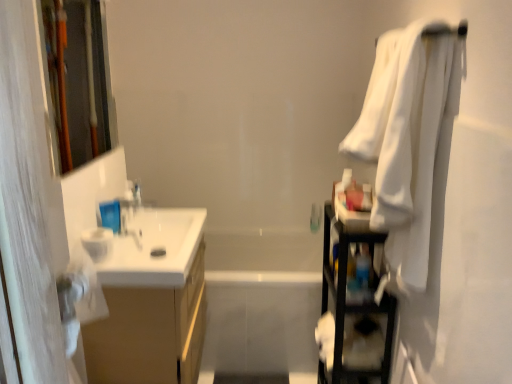
Where is `vacant region to the right of satin silver faucet at upper left`? This screenshot has height=384, width=512. vacant region to the right of satin silver faucet at upper left is located at coordinates (164, 217).